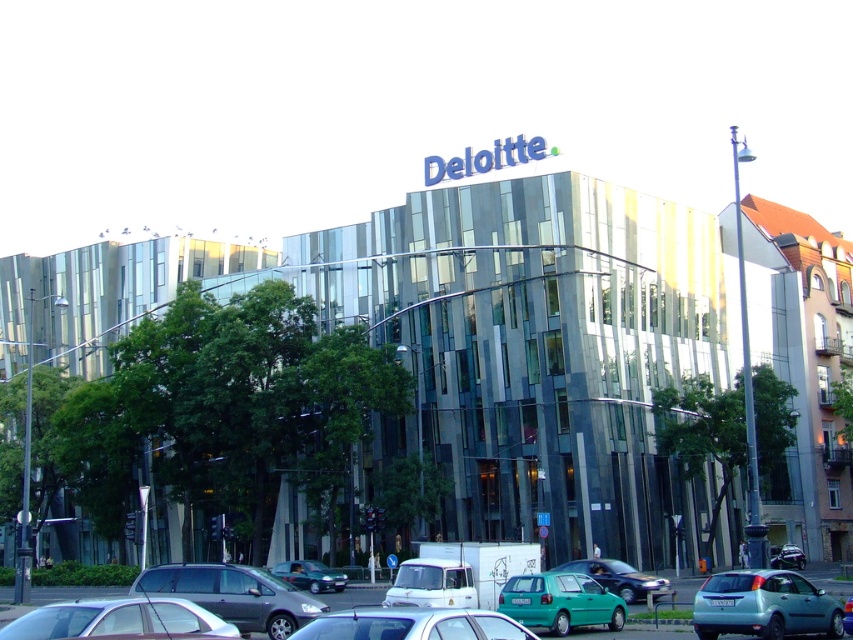
Question: Which point is farther to the camera?

Choices:
 (A) (578, 572)
 (B) (613, 604)
 (C) (802, 568)
 (D) (825, 612)

Answer: (C)

Question: Considering the relative positions of white matte van at center and metallic blue sedan at center in the image provided, where is white matte van at center located with respect to metallic blue sedan at center?

Choices:
 (A) left
 (B) right

Answer: (A)

Question: Can you confirm if teal glossy hatchback at center is thinner than white matte van at center?

Choices:
 (A) no
 (B) yes

Answer: (B)

Question: Estimate the real-world distances between objects in this image. Which object is farther from the white matte van at center?

Choices:
 (A) metallic green car at center
 (B) silver metallic car at lower left
 (C) metallic silver car at center

Answer: (C)

Question: Can you confirm if white matte van at center is positioned above metallic blue sedan at center?

Choices:
 (A) no
 (B) yes

Answer: (B)

Question: Which object is closer to the camera taking this photo?

Choices:
 (A) metallic green car at center
 (B) teal glossy hatchback at center
 (C) silver metallic car at lower left
 (D) white matte van at center

Answer: (C)